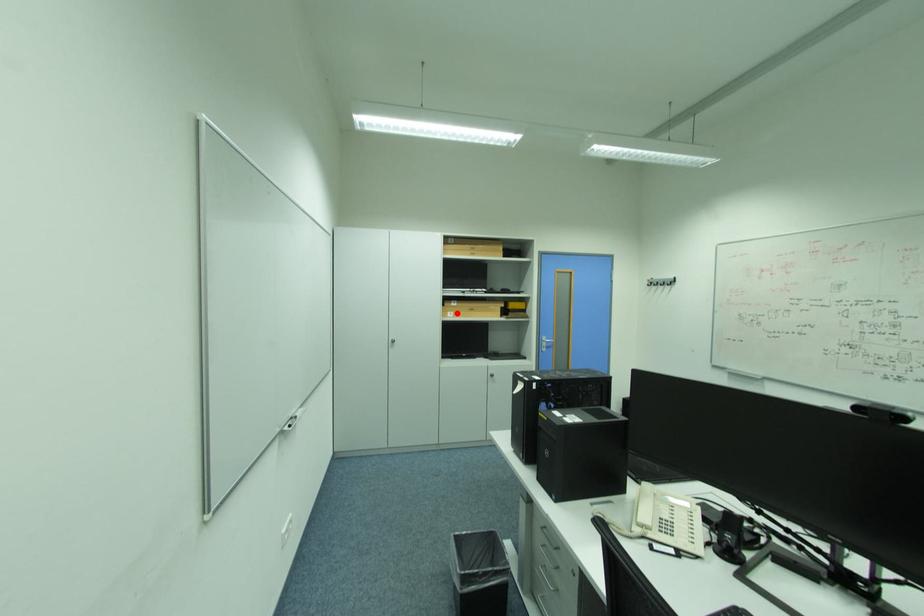
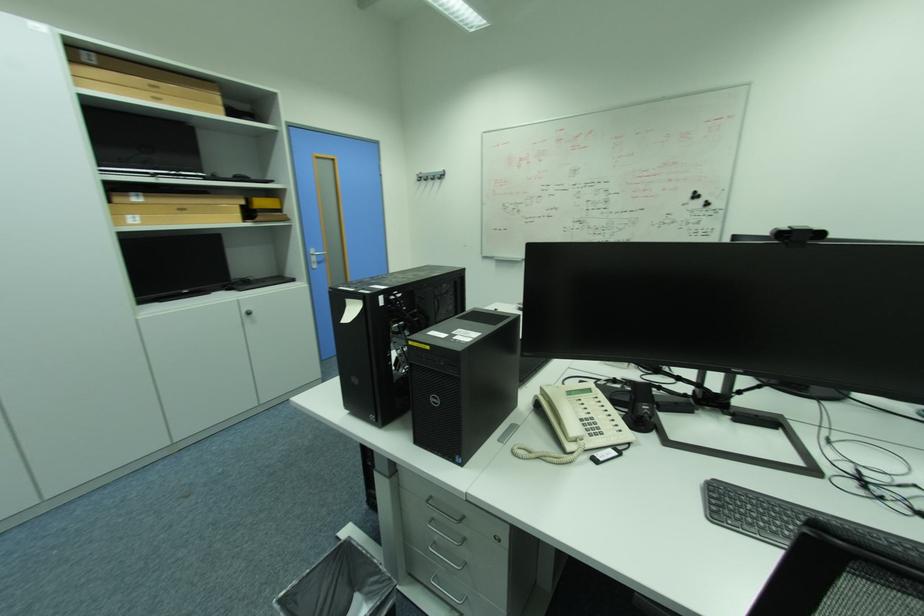
Where in the second image is the point corresponding to the highlighted location from the first image?

(136, 217)